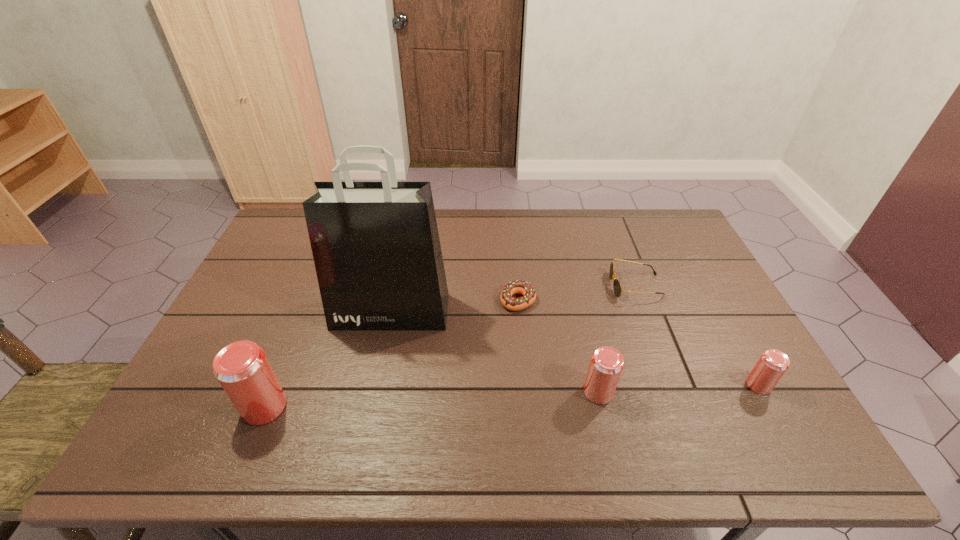
In the image, there is a desktop. Find the location of `vacant region at the far edge`. vacant region at the far edge is located at coordinates (464, 246).

In the image, there is a desktop. In order to click on vacant space at the near edge in this screenshot , I will do `click(349, 392)`.

In order to click on vacant area at the left edge of the desktop in this screenshot , I will do `click(236, 326)`.

Find the location of `vacant area at the right edge of the desktop`. vacant area at the right edge of the desktop is located at coordinates (728, 338).

Where is `vacant space at the far left corner of the desktop`? The width and height of the screenshot is (960, 540). vacant space at the far left corner of the desktop is located at coordinates (282, 247).

The image size is (960, 540). In order to click on vacant area at the far right corner of the desktop in this screenshot , I will do `click(679, 227)`.

This screenshot has height=540, width=960. I want to click on free spot between the leftmost beer can and the doughnut, so click(x=391, y=354).

Identify the location of free space that is in between the shortest beer can and the second object from right to left. (697, 335).

Where is `vacant area that lies between the third object from right to left and the rightmost object`? vacant area that lies between the third object from right to left and the rightmost object is located at coordinates (679, 388).

Find the location of a particular element. free space between the third object from left to right and the rightmost beer can is located at coordinates (638, 343).